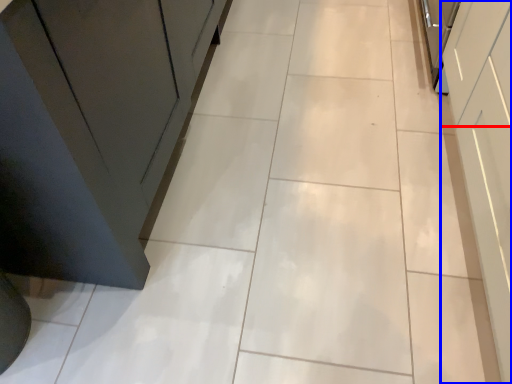
Question: Which object is closer to the camera taking this photo, drawer (highlighted by a red box) or cabinetry (highlighted by a blue box)?

Choices:
 (A) drawer
 (B) cabinetry

Answer: (B)